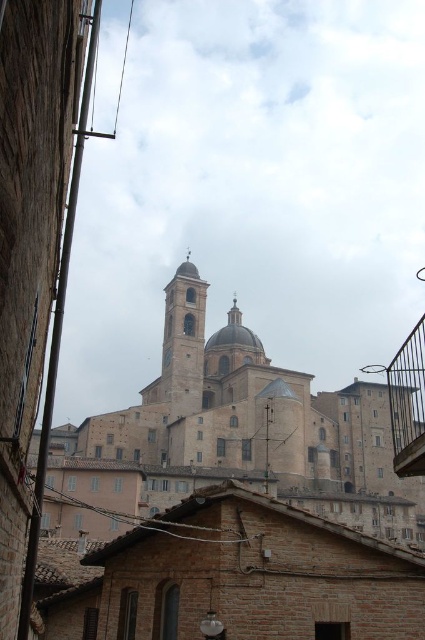
You are an architect evaluating the design of the historic complex. You need to determine which of the two elements, the smooth stone tower at center or the metallic balcony at lower right, requires more structural reinforcement based on their sizes. Which one should you prioritize?

The smooth stone tower at center is smaller than the metallic balcony at lower right, so the metallic balcony at lower right should be prioritized for structural reinforcement as it is larger and may require more support.

You are standing at the base of the hill looking towards the historic building complex. There are two points marked on the image. Which point, point (200, 321) or point (396, 452), is closer to the main dome of the cathedral?

Point (396, 452) is closer to the main dome of the cathedral because it is in front of point (200, 321).